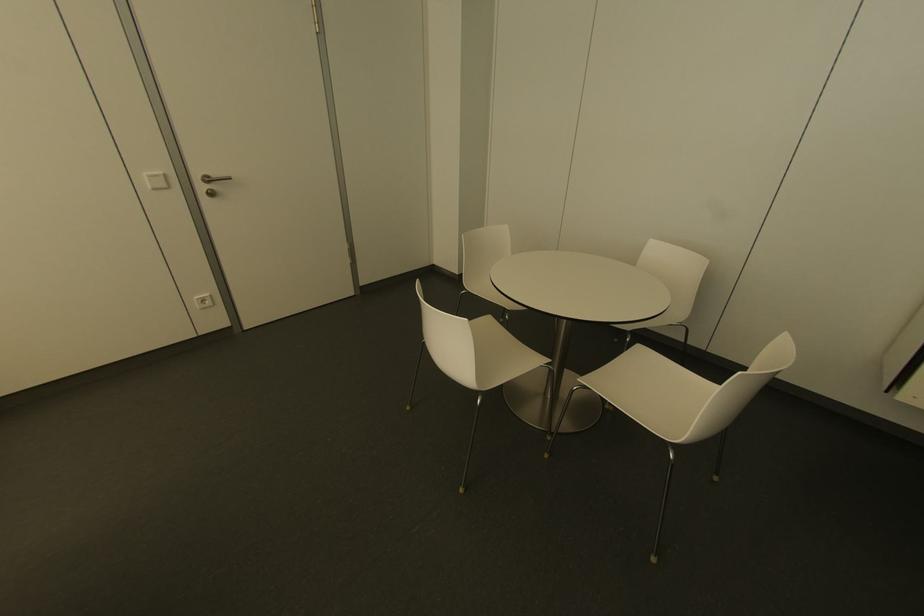
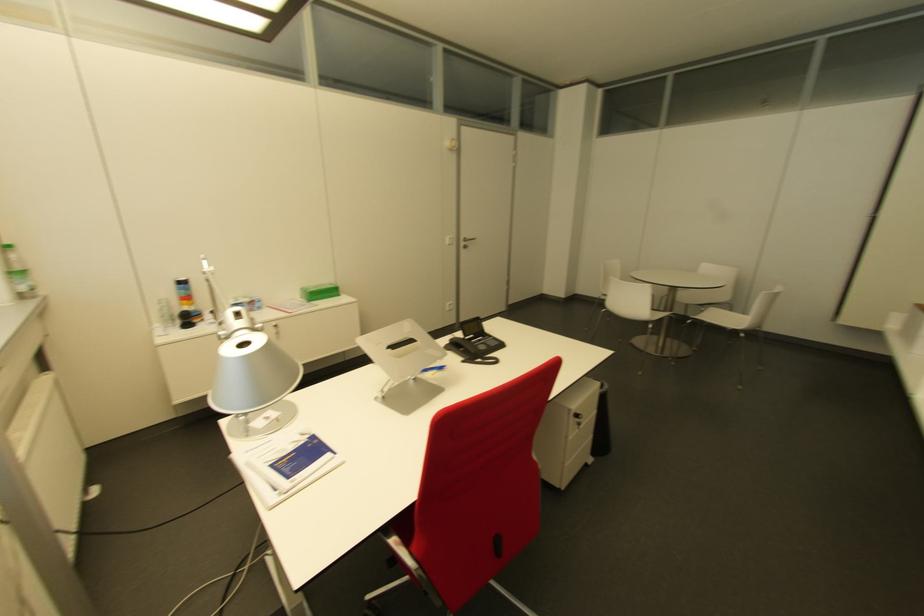
Locate, in the second image, the point that corresponds to the point at 210,193 in the first image.

(463, 246)